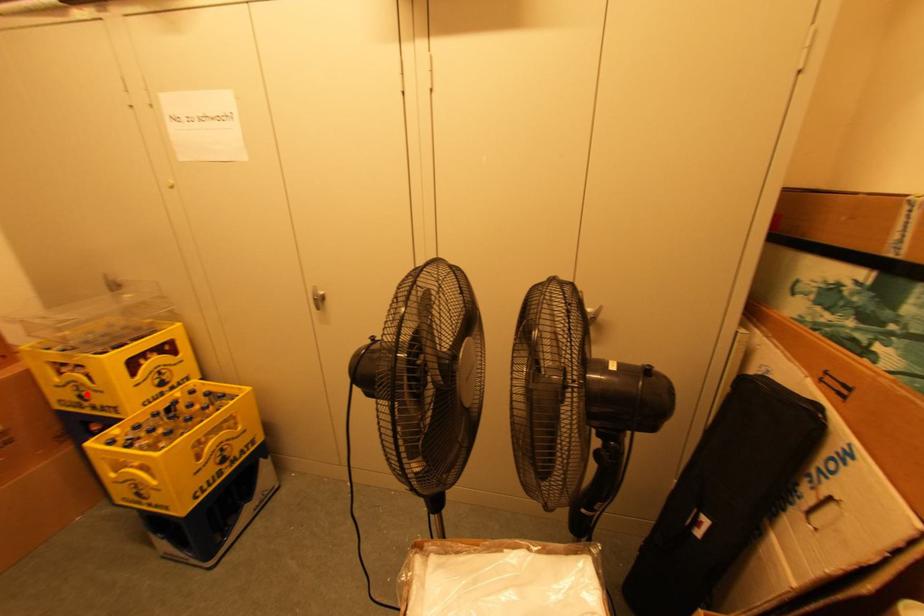
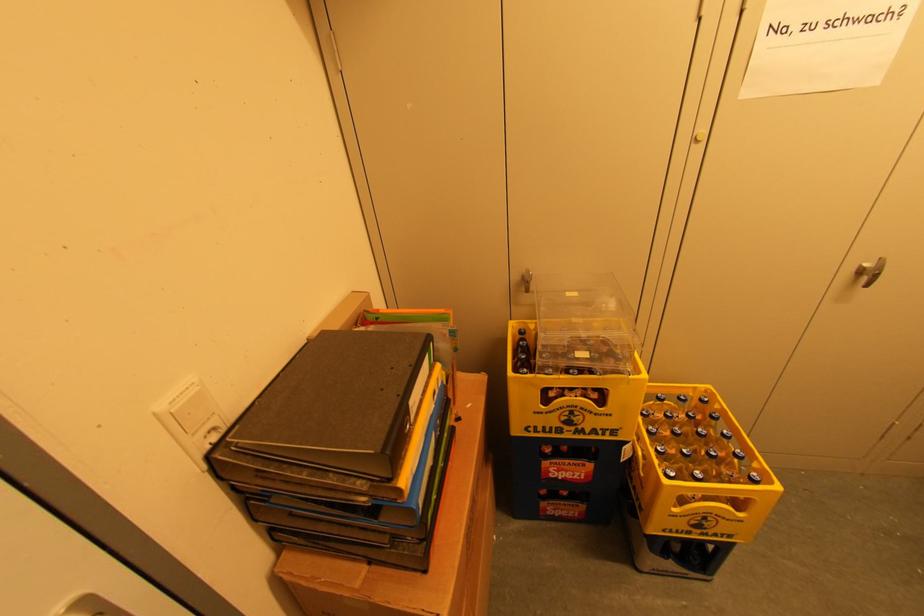
Question: I am providing you with two images of the same scene from different viewpoints. Given a red point in image1, look at the same physical point in image2. Is it:

Choices:
 (A) Closer to the viewpoint
 (B) Farther from the viewpoint

Answer: (B)